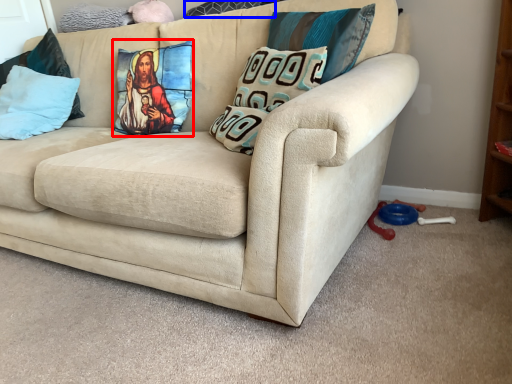
Question: Which object is further to the camera taking this photo, pillow (highlighted by a red box) or pillow (highlighted by a blue box)?

Choices:
 (A) pillow
 (B) pillow

Answer: (B)